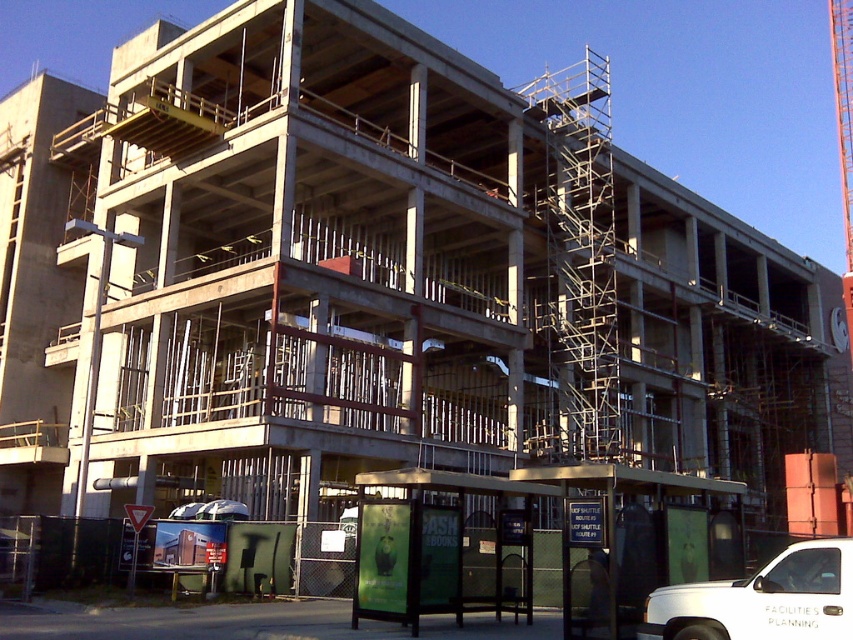
Is white matte truck at lower right above orange metallic crane at upper right?

Actually, white matte truck at lower right is below orange metallic crane at upper right.

Which of these two, white matte truck at lower right or orange metallic crane at upper right, stands shorter?

white matte truck at lower right

Between point (851, 605) and point (844, 93), which one is positioned behind?

The point (844, 93) is behind.

Identify the location of white matte truck at lower right. The width and height of the screenshot is (853, 640). (762, 600).